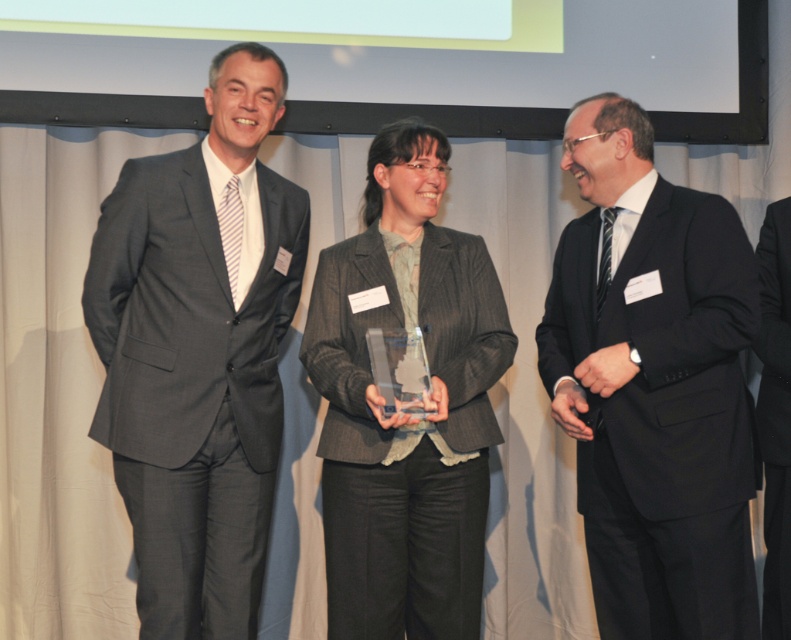
Which of these two, matte gray suit at left or gray pinstripe blazer at center, stands shorter?

Result: gray pinstripe blazer at center is shorter.

Does matte gray suit at left have a smaller size compared to gray pinstripe blazer at center?

Indeed, matte gray suit at left has a smaller size compared to gray pinstripe blazer at center.

Which is behind, point (176, 506) or point (479, 522)?

Positioned behind is point (479, 522).

Find the location of a particular element. This screenshot has height=640, width=791. matte gray suit at left is located at coordinates (199, 352).

Who is higher up, gray pinstripe blazer at center or black suit at right?

gray pinstripe blazer at center is higher up.

Is gray pinstripe blazer at center to the left of black suit at right from the viewer's perspective?

Indeed, gray pinstripe blazer at center is positioned on the left side of black suit at right.

Between point (345, 403) and point (776, 436), which one is positioned in front?

Point (345, 403) is more forward.

Locate an element on the screen. Image resolution: width=791 pixels, height=640 pixels. gray pinstripe blazer at center is located at coordinates (407, 413).

Between matte gray suit at left and black suit at right, which one is positioned lower?

black suit at right

Is point (218, 577) in front of point (778, 499)?

That is True.

Between point (187, 440) and point (789, 618), which one is positioned behind?

The point (789, 618) is more distant.

The image size is (791, 640). Identify the location of matte gray suit at left. (199, 352).